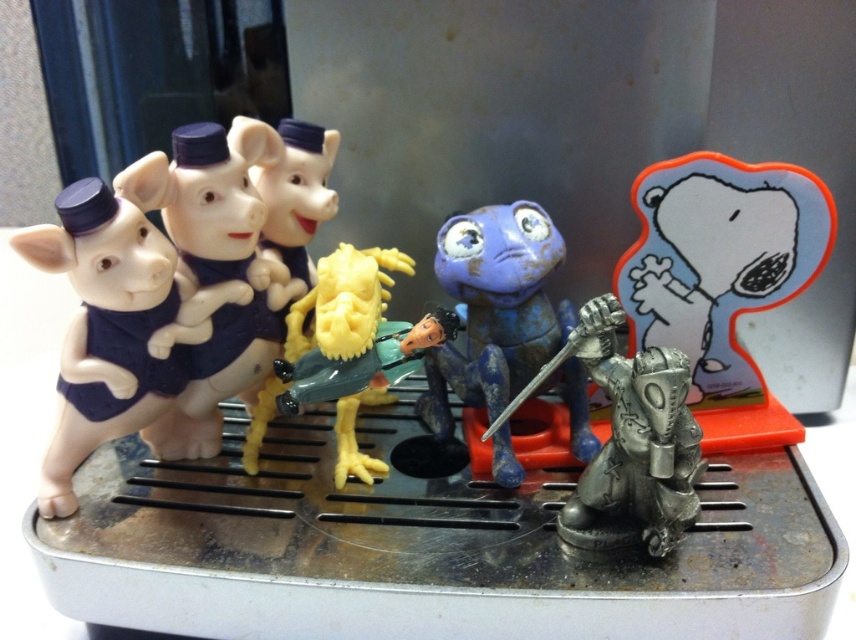
Is matte black piglets at left smaller than blue matte alien at center?

Correct, matte black piglets at left occupies less space than blue matte alien at center.

Between matte black piglets at left and blue matte alien at center, which one has more height?

matte black piglets at left

This screenshot has width=856, height=640. What are the coordinates of `matte black piglets at left` in the screenshot? It's located at (108, 326).

Does matte plastic pigs at left have a lesser width compared to blue matte alien at center?

Yes.

Does matte plastic pigs at left have a greater width compared to blue matte alien at center?

Incorrect, matte plastic pigs at left's width does not surpass blue matte alien at center's.

At what (x,y) coordinates should I click in order to perform the action: click on matte plastic pigs at left. Please return your answer as a coordinate pair (x, y). Looking at the image, I should click on (215, 268).

Locate an element on the screen. This screenshot has height=640, width=856. matte plastic pigs at left is located at coordinates (215, 268).

Which is above, matte black piglets at left or antique silver sword at center?

matte black piglets at left is higher up.

Which is behind, point (81, 458) or point (669, 438)?

Point (81, 458)

Which is in front, point (69, 371) or point (660, 420)?

Point (660, 420)

Find the location of a particular element. The height and width of the screenshot is (640, 856). matte black piglets at left is located at coordinates (108, 326).